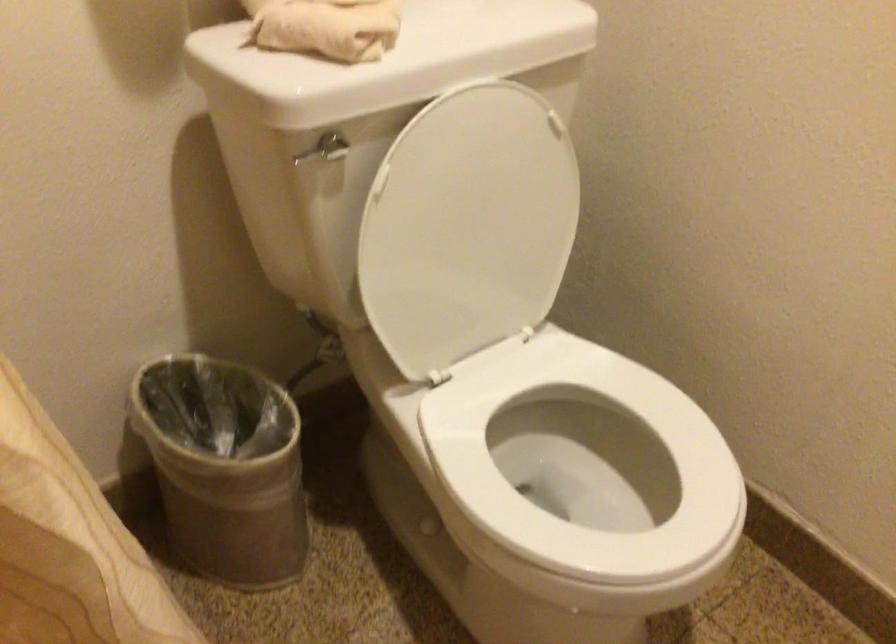
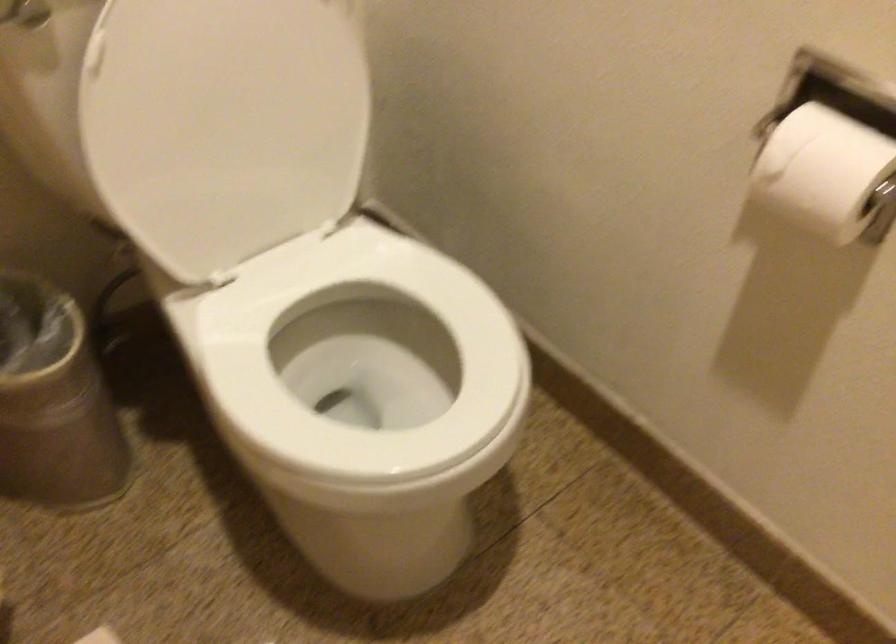
Where in the second image is the point corresponding to (x=474, y=229) from the first image?

(239, 114)